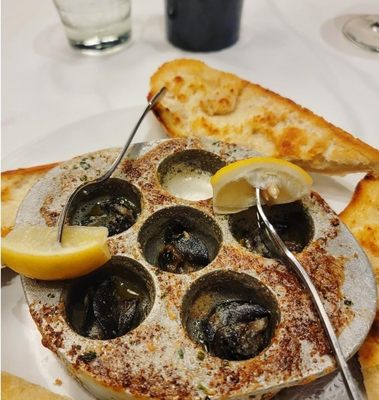
Find the location of a particular element. Image resolution: width=379 pixels, height=400 pixels. water inside glass cup is located at coordinates (96, 17).